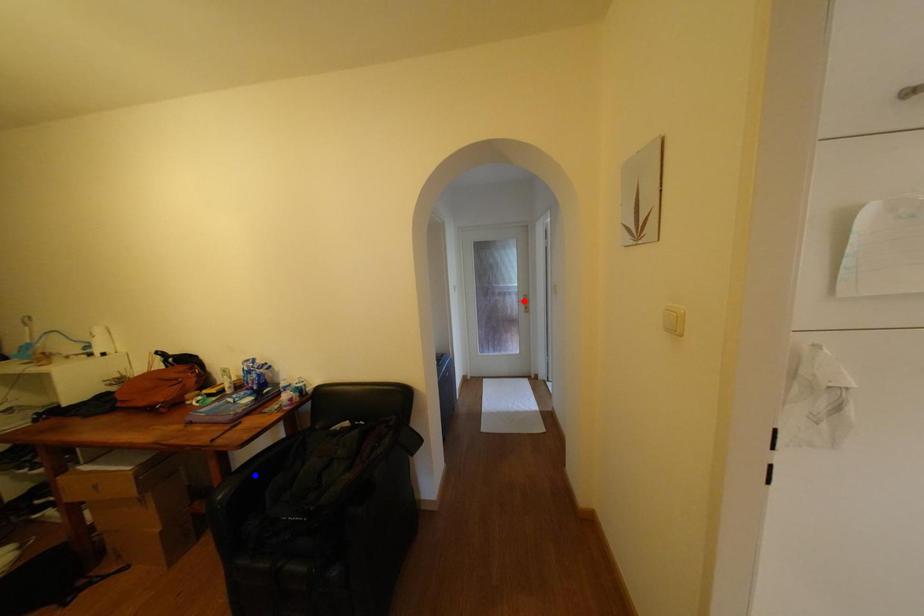
Question: In the image, two points are highlighted. Which point is nearer to the camera? Reply with the corresponding letter.

Choices:
 (A) blue point
 (B) red point

Answer: (A)